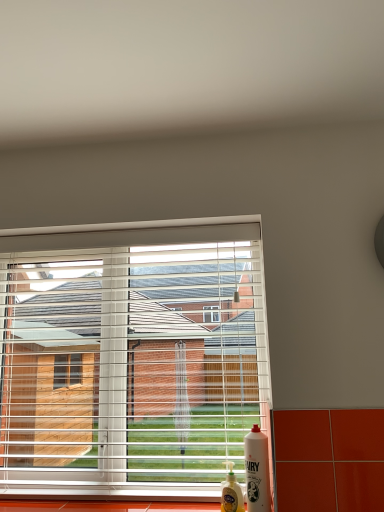
Question: Could you tell me if white glossy fairy liquid at lower right, the second bottle viewed from the left, is turned towards white plastic blinds at center?

Choices:
 (A) no
 (B) yes

Answer: (A)

Question: Does white glossy fairy liquid at lower right, the second bottle viewed from the left, have a smaller size compared to white plastic blinds at center?

Choices:
 (A) no
 (B) yes

Answer: (B)

Question: Is the position of white glossy fairy liquid at lower right, the second bottle viewed from the left, less distant than that of white plastic blinds at center?

Choices:
 (A) no
 (B) yes

Answer: (B)

Question: Does white glossy fairy liquid at lower right, the second bottle viewed from the left, lie behind white plastic blinds at center?

Choices:
 (A) yes
 (B) no

Answer: (B)

Question: Is white glossy fairy liquid at lower right, the second bottle viewed from the left, thinner than white plastic blinds at center?

Choices:
 (A) yes
 (B) no

Answer: (A)

Question: Is white plastic blinds at center taller or shorter than white glossy fairy liquid at lower right, the second bottle viewed from the left?

Choices:
 (A) short
 (B) tall

Answer: (B)

Question: Considering the positions of white plastic blinds at center and white glossy fairy liquid at lower right, the second bottle viewed from the left, in the image, is white plastic blinds at center bigger or smaller than white glossy fairy liquid at lower right, the second bottle viewed from the left,?

Choices:
 (A) small
 (B) big

Answer: (B)

Question: Is point (172, 349) positioned closer to the camera than point (256, 492)?

Choices:
 (A) farther
 (B) closer

Answer: (A)

Question: In terms of width, does white plastic blinds at center look wider or thinner when compared to white glossy fairy liquid at lower right, the second bottle viewed from the left?

Choices:
 (A) thin
 (B) wide

Answer: (B)

Question: Would you say white plastic blinds at center is inside or outside translucent plastic bottle at lower right, which is the second bottle from right to left?

Choices:
 (A) outside
 (B) inside

Answer: (A)

Question: Is white plastic blinds at center wider or thinner than translucent plastic bottle at lower right, the first bottle from the left?

Choices:
 (A) thin
 (B) wide

Answer: (B)

Question: Considering the positions of point (228, 233) and point (226, 507), is point (228, 233) closer or farther from the camera than point (226, 507)?

Choices:
 (A) farther
 (B) closer

Answer: (A)

Question: Considering the positions of white plastic blinds at center and translucent plastic bottle at lower right, which is the second bottle from right to left, in the image, is white plastic blinds at center taller or shorter than translucent plastic bottle at lower right, which is the second bottle from right to left,?

Choices:
 (A) tall
 (B) short

Answer: (A)

Question: From a real-world perspective, is white glossy fairy liquid at lower right, the second bottle viewed from the left, above or below white plastic blinds at center?

Choices:
 (A) above
 (B) below

Answer: (B)

Question: Is white glossy fairy liquid at lower right, the second bottle viewed from the left, taller or shorter than white plastic blinds at center?

Choices:
 (A) tall
 (B) short

Answer: (B)